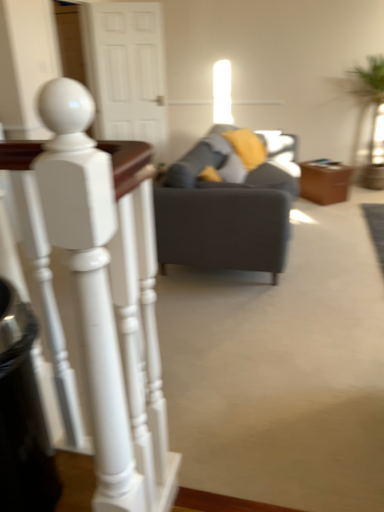
Question: Is point (322, 165) positioned closer to the camera than point (119, 350)?

Choices:
 (A) closer
 (B) farther

Answer: (B)

Question: Looking at their shapes, would you say brown leather side table at center is wider or thinner than white glossy staircase railing at left?

Choices:
 (A) thin
 (B) wide

Answer: (B)

Question: Which object is positioned closest to the gray fabric swivel chair at center?

Choices:
 (A) matte gray couch at center
 (B) green leafy plant at right
 (C) brown leather side table at center
 (D) white wood door at upper center
 (E) white glossy staircase railing at left

Answer: (A)

Question: Estimate the real-world distances between objects in this image. Which object is closer to the green leafy plant at right?

Choices:
 (A) white wood door at upper center
 (B) brown leather side table at center
 (C) matte gray couch at center
 (D) white glossy staircase railing at left
 (E) black plastic trash can at lower left

Answer: (B)